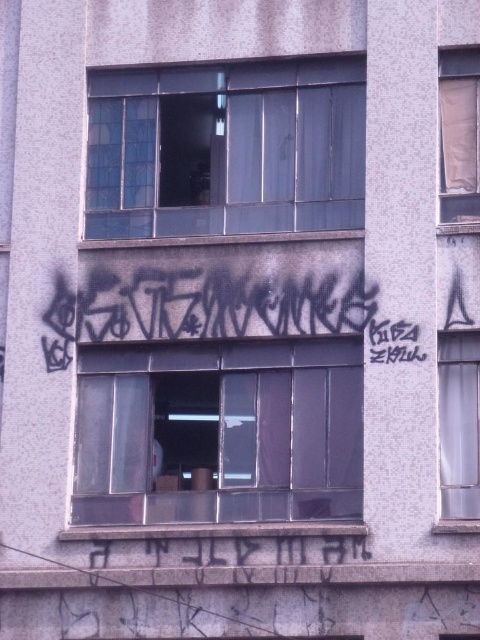
Does clear glass window at right have a larger size compared to brown paper at upper right?

Incorrect, clear glass window at right is not larger than brown paper at upper right.

Who is higher up, clear glass window at right or brown paper at upper right?

brown paper at upper right is above.

Who is more distant from viewer, (x=460, y=349) or (x=455, y=97)?

Positioned behind is point (x=455, y=97).

This screenshot has height=640, width=480. What are the coordinates of `clear glass window at right` in the screenshot? It's located at [x=458, y=424].

Identify the location of black spray paint graffiti at center. The height and width of the screenshot is (640, 480). (218, 310).

Who is positioned more to the right, black spray paint graffiti at center or clear glass window at right?

clear glass window at right is more to the right.

Is point (58, 310) positioned in front of point (468, 401)?

No, it is behind (468, 401).

Where is `black spray paint graffiti at center`? The height and width of the screenshot is (640, 480). black spray paint graffiti at center is located at coordinates (218, 310).

Is point (348, 113) closer to camera compared to point (442, 106)?

No, (348, 113) is further to viewer.

Which is behind, point (142, 134) or point (459, 220)?

Point (142, 134)

Find the location of `clear glass window at upper center`. clear glass window at upper center is located at coordinates (226, 148).

The image size is (480, 640). Identify the location of clear glass window at upper center. (226, 148).